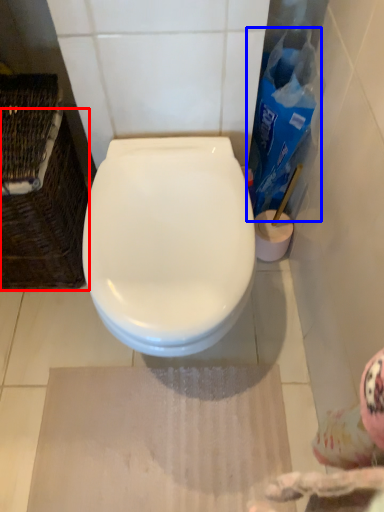
Question: Which of the following is the farthest to the observer, basket (highlighted by a red box) or cleaning product (highlighted by a blue box)?

Choices:
 (A) basket
 (B) cleaning product

Answer: (B)